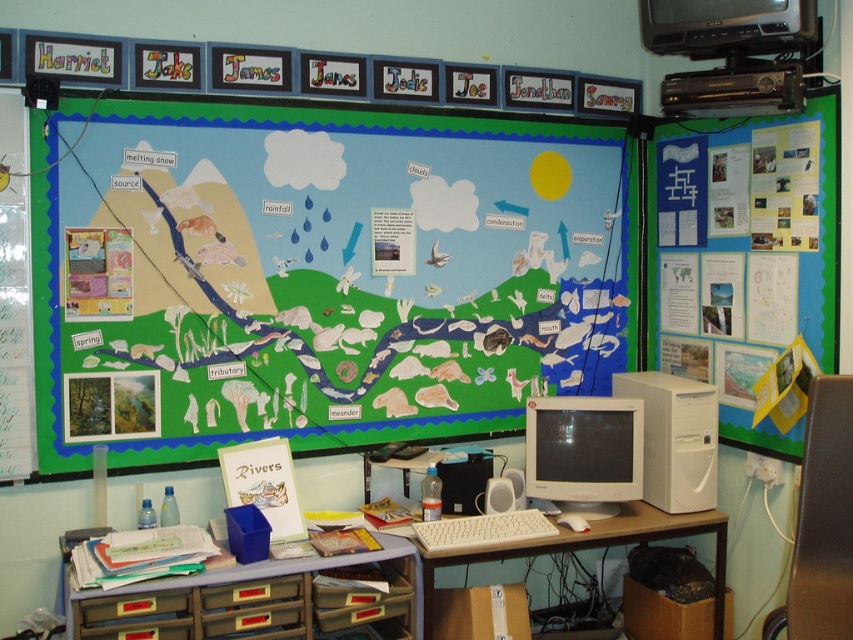
Does plastic drawer unit at lower center have a larger size compared to white plastic desktop computer at upper right?

Yes.

Which is more to the left, plastic drawer unit at lower center or white plastic desktop computer at upper right?

From the viewer's perspective, plastic drawer unit at lower center appears more on the left side.

Who is more distant from viewer, (x=267, y=577) or (x=691, y=100)?

Positioned behind is point (x=691, y=100).

Identify the location of plastic drawer unit at lower center. (242, 600).

Who is lower down, white plastic computer at center or matte black monitor at upper right?

white plastic computer at center is lower down.

Which is behind, point (700, 477) or point (653, 17)?

Point (700, 477)

Where is `white plastic computer at center`? This screenshot has width=853, height=640. white plastic computer at center is located at coordinates (675, 438).

Locate an element on the screen. white plastic computer at center is located at coordinates (675, 438).

The height and width of the screenshot is (640, 853). What do you see at coordinates (584, 452) in the screenshot?
I see `matte white monitor at center` at bounding box center [584, 452].

Between matte white monitor at center and matte black monitor at upper right, which one is positioned higher?

matte black monitor at upper right is higher up.

Describe the element at coordinates (584, 452) in the screenshot. The image size is (853, 640). I see `matte white monitor at center` at that location.

Where is `matte white monitor at center`? matte white monitor at center is located at coordinates (584, 452).